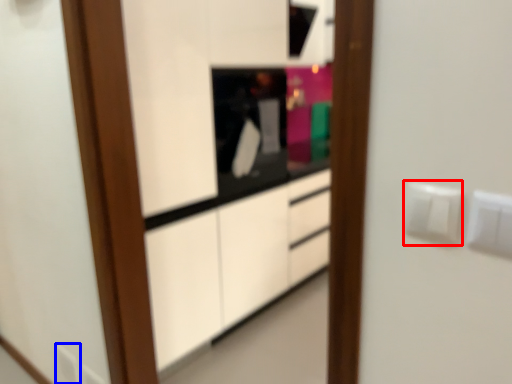
Question: Among these objects, which one is nearest to the camera, electric outlet (highlighted by a red box) or electric outlet (highlighted by a blue box)?

Choices:
 (A) electric outlet
 (B) electric outlet

Answer: (A)